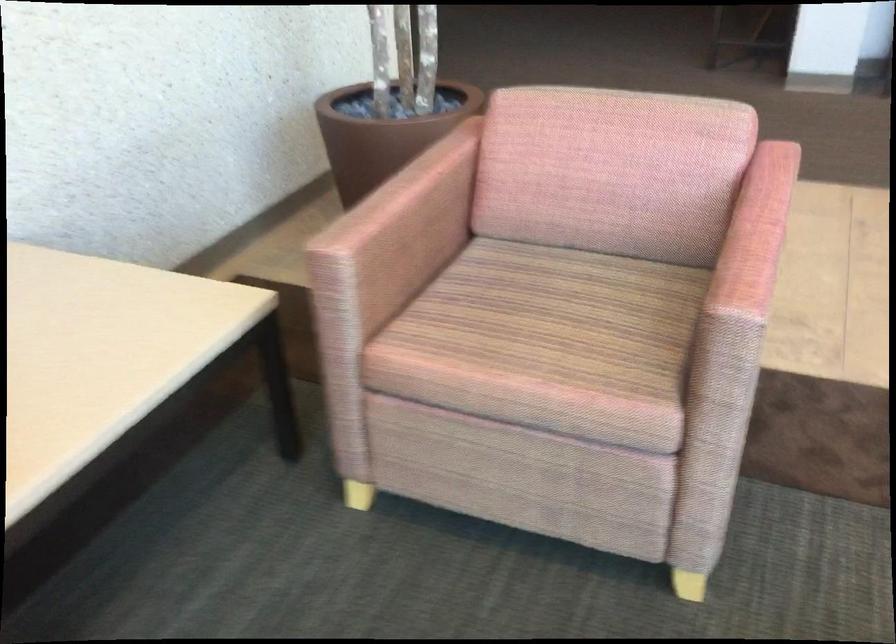
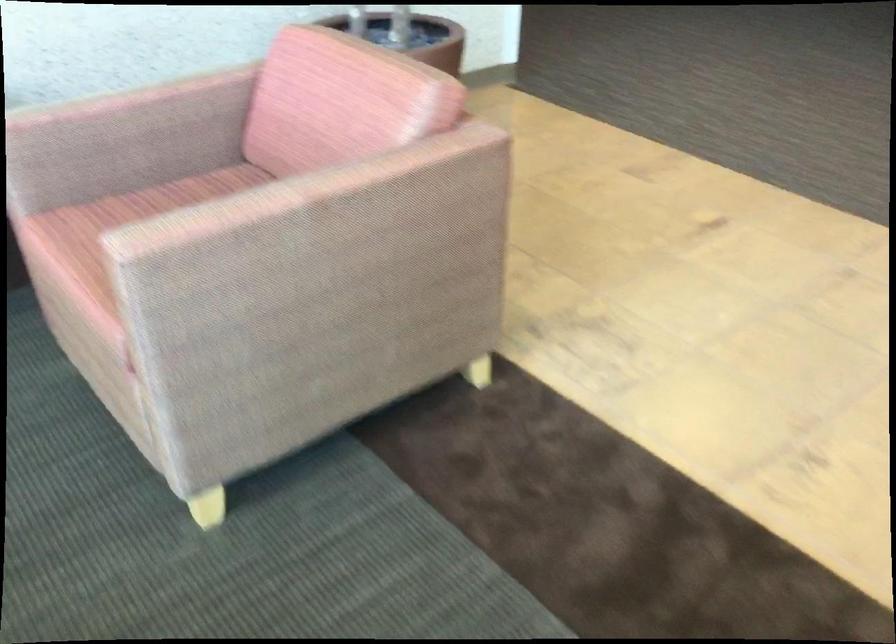
Find the pixel in the second image that matches point (416, 194) in the first image.

(121, 98)